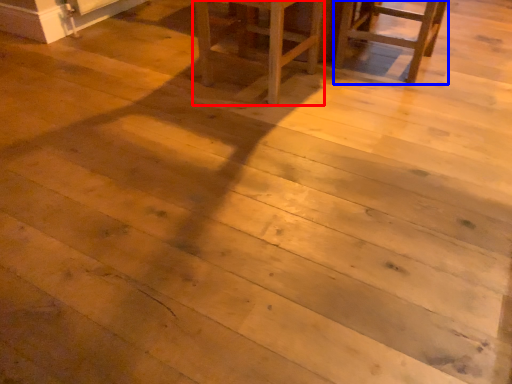
Question: Which of the following is the closest to the observer, furniture (highlighted by a red box) or chair (highlighted by a blue box)?

Choices:
 (A) furniture
 (B) chair

Answer: (A)